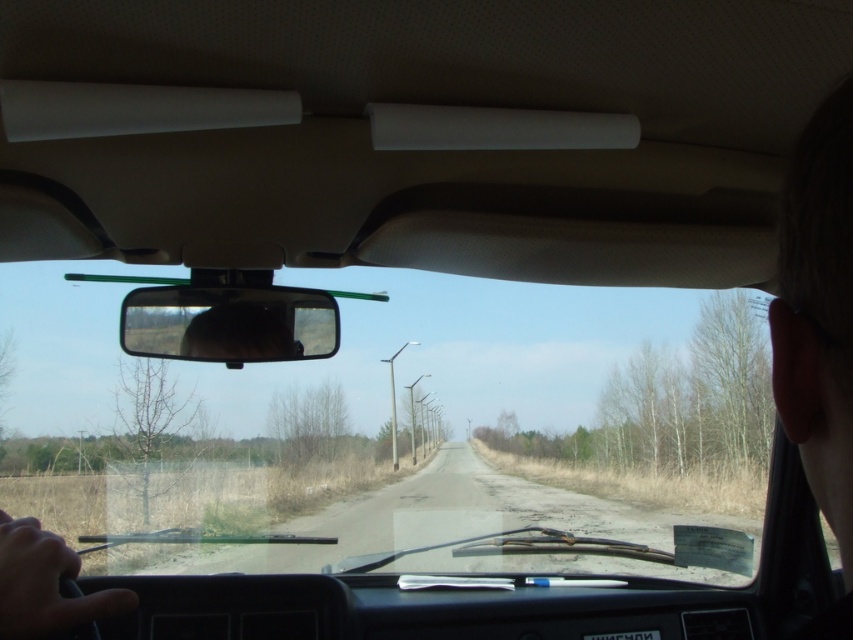
Does transparent glass windshield at center appear under black glossy rearview mirror at center?

Yes.

Consider the image. Can you confirm if transparent glass windshield at center is wider than black glossy rearview mirror at center?

Yes.

Is point (381, 451) positioned behind point (300, 355)?

Yes, point (381, 451) is farther from viewer.

Identify the location of transparent glass windshield at center. (386, 426).